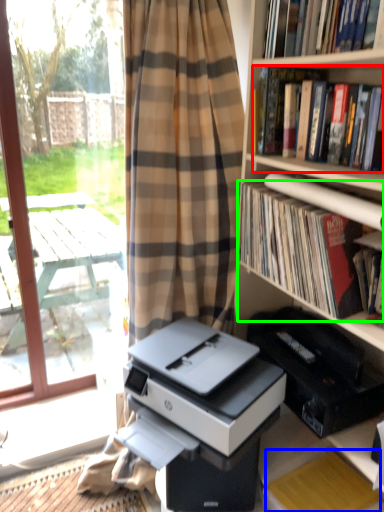
Question: Based on their relative distances, which object is farther from book (highlighted by a red box)? Choose from paperback book (highlighted by a blue box) and book (highlighted by a green box).

Choices:
 (A) paperback book
 (B) book

Answer: (A)